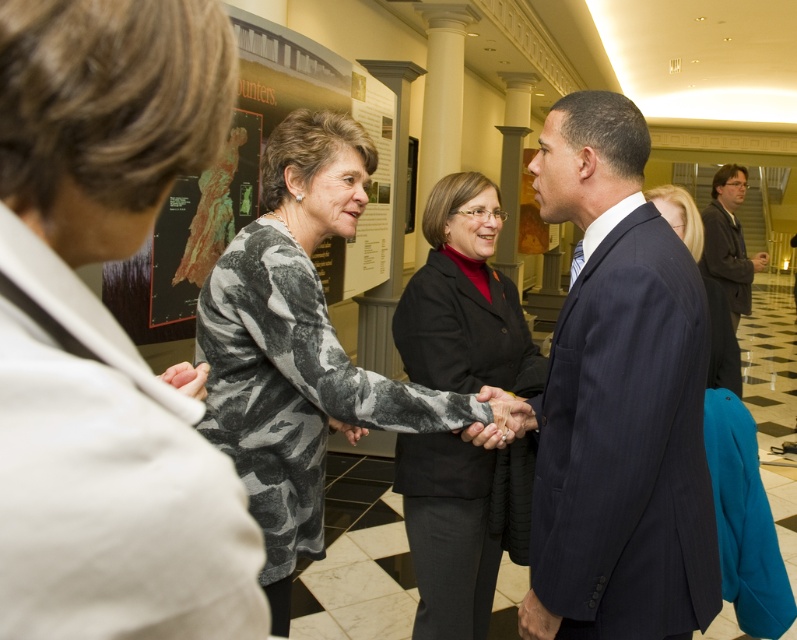
Consider the image. You are a security guard in the museum and need to ensure that all visitors are following the dress code, which requires that the height of the suit must be at least 1.5 times the height of the person wearing it. You observe the dark blue pinstripe suit at center and the dark gray suit at right. Which suit is more likely to violate the dress code?

The dark blue pinstripe suit at center is not as tall as the dark gray suit at right. Since the dress code requires the suit height to be at least 1.5 times the person height, the taller dark gray suit at right is more likely to comply, while the shorter dark blue pinstripe suit at center might violate the requirement if its height is insufficient relative to the wearer.